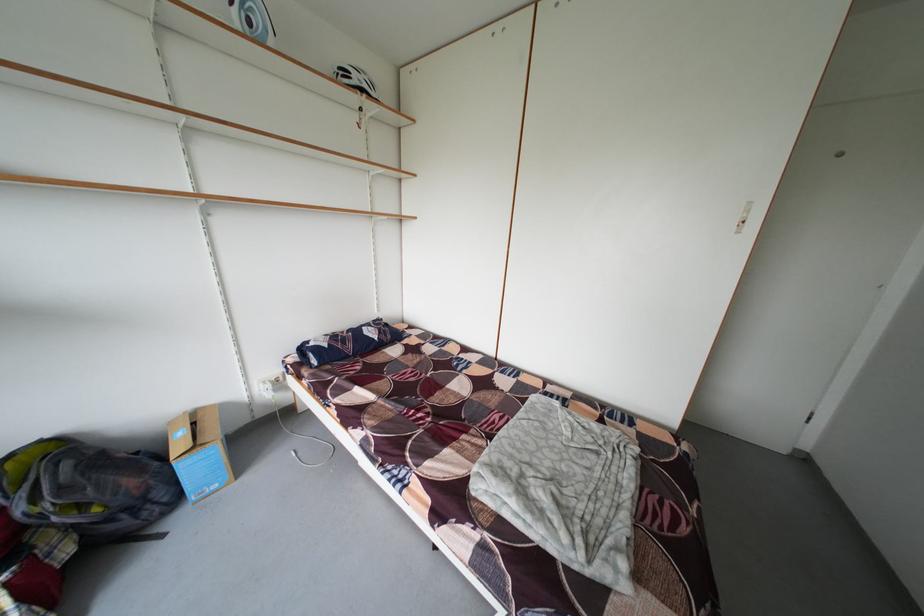
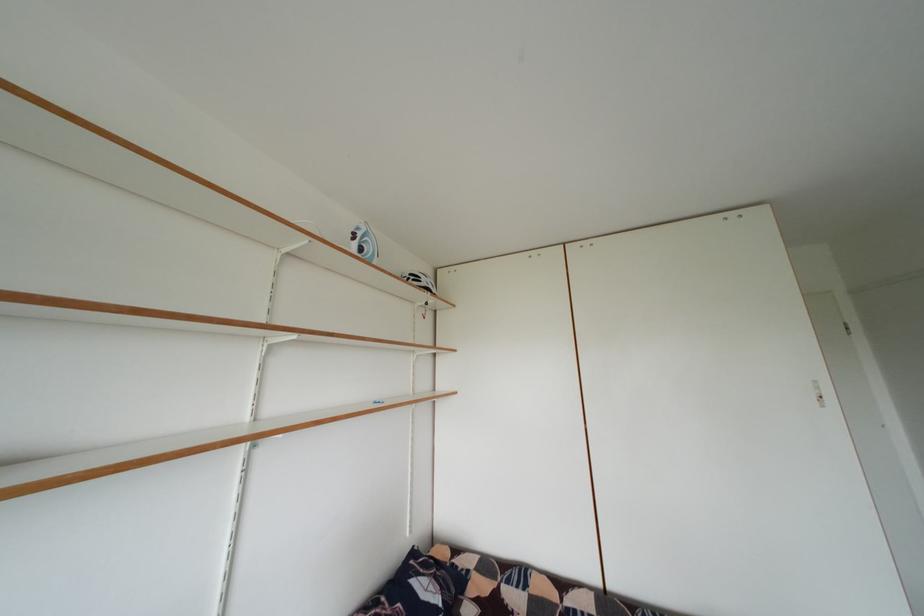
Where in the second image is the point corresponding to point (350, 74) from the first image?

(420, 281)